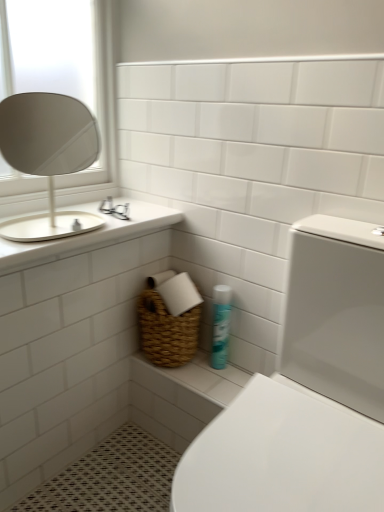
Question: Based on their sizes in the image, would you say woven basket at lower center is bigger or smaller than white glossy countertop at upper left?

Choices:
 (A) small
 (B) big

Answer: (A)

Question: Do you think woven basket at lower center is within white glossy countertop at upper left, or outside of it?

Choices:
 (A) outside
 (B) inside

Answer: (A)

Question: Considering the real-world distances, which object is farthest from the white glossy countertop at upper left?

Choices:
 (A) woven basket at lower center
 (B) white ceramic sink at upper left
 (C) white glossy toilet at lower right
 (D) blue glossy spray can at lower center

Answer: (C)

Question: Which of these objects is positioned closest to the blue glossy spray can at lower center?

Choices:
 (A) white glossy toilet at lower right
 (B) white glossy countertop at upper left
 (C) white ceramic sink at upper left
 (D) woven basket at lower center

Answer: (D)